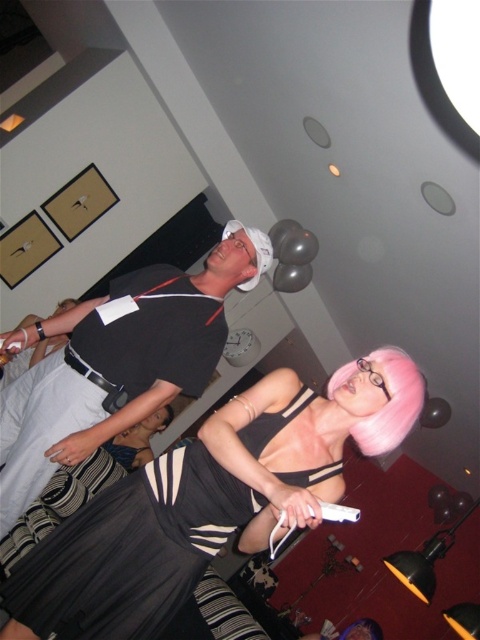
Does black satin dress at center appear over black matte shirt at upper center?

No.

Is black satin dress at center closer to camera compared to black matte shirt at upper center?

That is True.

Is point (149, 512) in front of point (193, 312)?

Yes, it is.

In order to click on black satin dress at center in this screenshot , I will do `click(177, 520)`.

Where is `black matte shirt at upper center`? Image resolution: width=480 pixels, height=640 pixels. black matte shirt at upper center is located at coordinates (118, 362).

Which is in front, point (148, 353) or point (351, 508)?

Positioned in front is point (148, 353).

Where is `black matte shirt at upper center`? Image resolution: width=480 pixels, height=640 pixels. black matte shirt at upper center is located at coordinates (118, 362).

Which is behind, point (300, 417) or point (327, 513)?

The point (300, 417) is behind.

Between black satin dress at center and white matte wii remote at center, which one appears on the right side from the viewer's perspective?

white matte wii remote at center

Measure the distance between point (132, 589) and camera.

The distance of point (132, 589) from camera is 1.61 meters.

This screenshot has width=480, height=640. Identify the location of black satin dress at center. (177, 520).